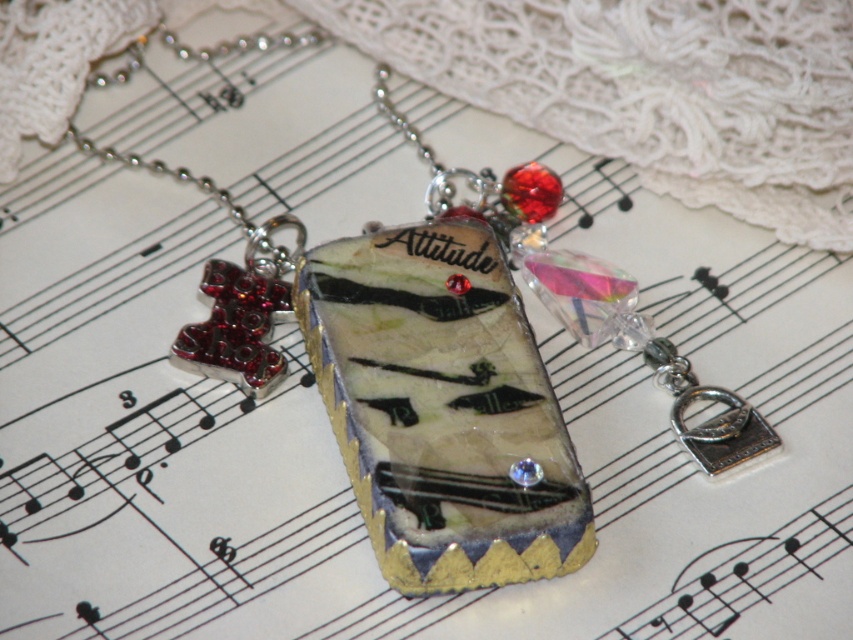
Question: Which object appears farthest from the camera in this image?

Choices:
 (A) translucent resin pendant at center
 (B) translucent glass pendant at center

Answer: (B)

Question: Which point appears closest to the camera in this image?

Choices:
 (A) (601, 340)
 (B) (367, 346)

Answer: (B)

Question: Among these objects, which one is nearest to the camera?

Choices:
 (A) translucent glass pendant at center
 (B) translucent resin pendant at center

Answer: (B)

Question: Does translucent resin pendant at center come in front of translucent glass pendant at center?

Choices:
 (A) no
 (B) yes

Answer: (B)

Question: Is translucent resin pendant at center thinner than translucent glass pendant at center?

Choices:
 (A) no
 (B) yes

Answer: (B)

Question: Where is translucent resin pendant at center located in relation to translucent glass pendant at center in the image?

Choices:
 (A) above
 (B) below

Answer: (B)